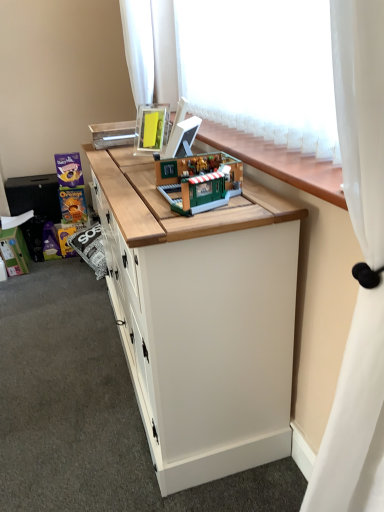
Question: Can you confirm if wooden counter top at center is positioned to the right of matte purple chocolate bar at left, positioned as the 2th toy in back-to-front order?

Choices:
 (A) yes
 (B) no

Answer: (A)

Question: From a real-world perspective, is wooden counter top at center positioned over matte purple chocolate bar at left, acting as the second toy starting from the right, based on gravity?

Choices:
 (A) no
 (B) yes

Answer: (B)

Question: Can you confirm if wooden counter top at center is thinner than matte purple chocolate bar at left, positioned as the 2th toy in back-to-front order?

Choices:
 (A) yes
 (B) no

Answer: (B)

Question: Is wooden counter top at center facing away from matte purple chocolate bar at left, which ranks as the second toy in front-to-back order?

Choices:
 (A) yes
 (B) no

Answer: (B)

Question: Can you confirm if wooden counter top at center is bigger than matte purple chocolate bar at left, acting as the second toy starting from the right?

Choices:
 (A) no
 (B) yes

Answer: (B)

Question: Would you say brick-like green building at center, the third toy from the back, is inside or outside white sheer curtain at upper center, arranged as the 2th curtain when viewed from the front?

Choices:
 (A) inside
 (B) outside

Answer: (B)

Question: In the image, is brick-like green building at center, the third toy from the back, on the left side or the right side of white sheer curtain at upper center, the first curtain viewed from the back?

Choices:
 (A) right
 (B) left

Answer: (A)

Question: Is point (188, 189) positioned closer to the camera than point (127, 38)?

Choices:
 (A) farther
 (B) closer

Answer: (B)

Question: In terms of height, does brick-like green building at center, which appears as the first toy when viewed from the front, look taller or shorter compared to white sheer curtain at upper center, arranged as the 2th curtain when viewed from the front?

Choices:
 (A) short
 (B) tall

Answer: (A)

Question: Visually, is white sheer curtain at upper right, which is the 1th curtain from front to back, positioned to the left or to the right of brick-like green building at center, which is the third toy in left-to-right order?

Choices:
 (A) right
 (B) left

Answer: (A)

Question: Considering the positions of white sheer curtain at upper right, positioned as the 2th curtain in left-to-right order, and brick-like green building at center, which is the third toy in left-to-right order, in the image, is white sheer curtain at upper right, positioned as the 2th curtain in left-to-right order, wider or thinner than brick-like green building at center, which is the third toy in left-to-right order,?

Choices:
 (A) wide
 (B) thin

Answer: (A)

Question: From a real-world perspective, is white sheer curtain at upper right, which ranks as the 1th curtain in bottom-to-top order, positioned above or below brick-like green building at center, which is the third toy in left-to-right order?

Choices:
 (A) above
 (B) below

Answer: (B)

Question: Is white sheer curtain at upper right, placed as the 2th curtain when sorted from top to bottom, situated inside brick-like green building at center, which appears as the first toy when viewed from the front, or outside?

Choices:
 (A) inside
 (B) outside

Answer: (B)

Question: Considering the positions of point (152, 3) and point (359, 119), is point (152, 3) closer or farther from the camera than point (359, 119)?

Choices:
 (A) closer
 (B) farther

Answer: (B)

Question: From a real-world perspective, relative to white sheer curtain at upper right, placed as the 2th curtain when sorted from top to bottom, is white sheer curtain at upper center, which is the first curtain in top-to-bottom order, vertically above or below?

Choices:
 (A) below
 (B) above

Answer: (B)